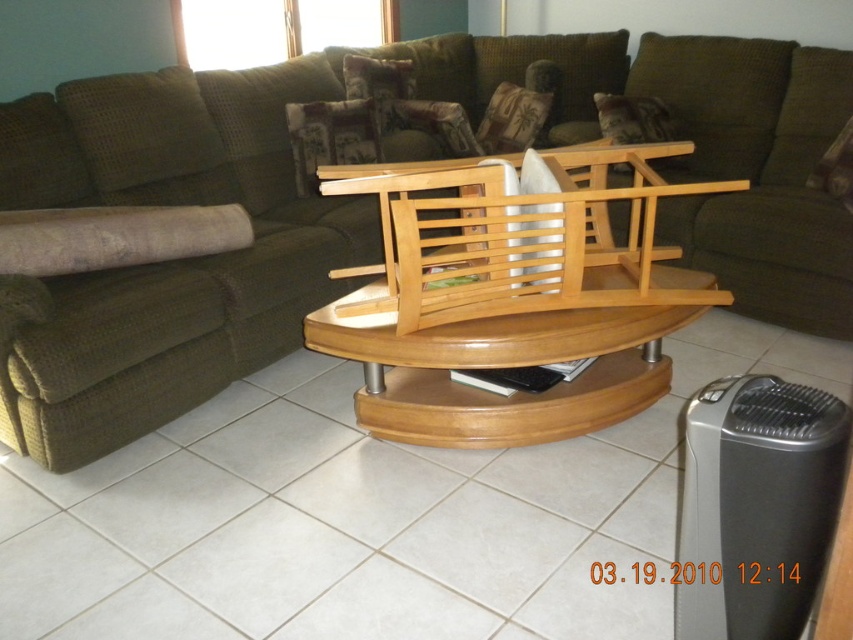
You are a delivery person carrying a large package that measures 36 inches in length. You need to place it between the green fabric couch at center and the wooden table at center. Is there enough space to fit the package between them?

The distance between the green fabric couch at center and the wooden table at center is 34.32 inches. Since the package is 36 inches long, it is slightly longer than the available space. Therefore, the package cannot be placed between them without overlapping either the couch or the table.

You are standing in the living room and see two points marked in the image. Which point is closer to you, point (x=218, y=266) or point (x=561, y=291)?

Point (x=218, y=266) is further to the viewer than point (x=561, y=291), so point (x=561, y=291) is closer to you.

You are sitting in the living room and want to move from the natural wood rocking chair at center to the wooden table at center. In which direction should you move to reach it?

Result: The wooden table at center is to the right of the natural wood rocking chair at center, so you should move to the right to reach it.